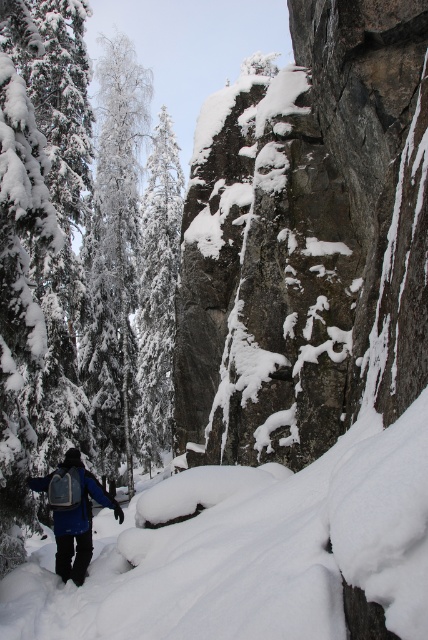
Question: Can you confirm if white snow-covered tree at left is bigger than white snow-covered tree at center?

Choices:
 (A) yes
 (B) no

Answer: (A)

Question: Which point is farther from the camera taking this photo?

Choices:
 (A) (158, 262)
 (B) (70, 573)

Answer: (A)

Question: Which point appears farthest from the camera in this image?

Choices:
 (A) [x=80, y=502]
 (B) [x=142, y=392]
 (C) [x=79, y=364]

Answer: (B)

Question: Among these points, which one is farthest from the camera?

Choices:
 (A) (112, 108)
 (B) (145, 364)

Answer: (B)

Question: Can you confirm if white snow-covered tree at left is smaller than white snow-covered tree at center?

Choices:
 (A) no
 (B) yes

Answer: (A)

Question: Can you confirm if white snow-covered tree at center is positioned to the right of blue fabric backpack at lower left?

Choices:
 (A) yes
 (B) no

Answer: (B)